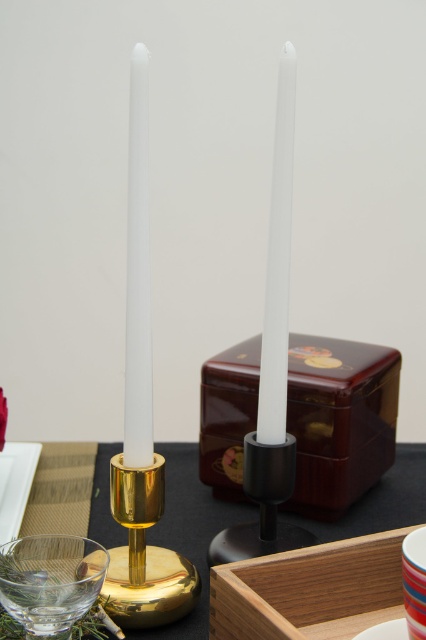
Question: Is white matte candle at left wider than matte red saucer at lower right?

Choices:
 (A) yes
 (B) no

Answer: (A)

Question: Which point is farther to the camera?

Choices:
 (A) (285, 58)
 (B) (46, 580)

Answer: (A)

Question: Is white matte candle at left positioned behind matte red saucer at lower right?

Choices:
 (A) no
 (B) yes

Answer: (B)

Question: Estimate the real-world distances between objects in this image. Which object is closer to the gold metallic candlestick at center?

Choices:
 (A) matte red saucer at lower right
 (B) white matte candle at left

Answer: (B)

Question: Which point is farther to the camera?

Choices:
 (A) (144, 204)
 (B) (86, 547)

Answer: (A)

Question: Is gold metallic candlestick at center to the right of transparent glass at lower left from the viewer's perspective?

Choices:
 (A) no
 (B) yes

Answer: (B)